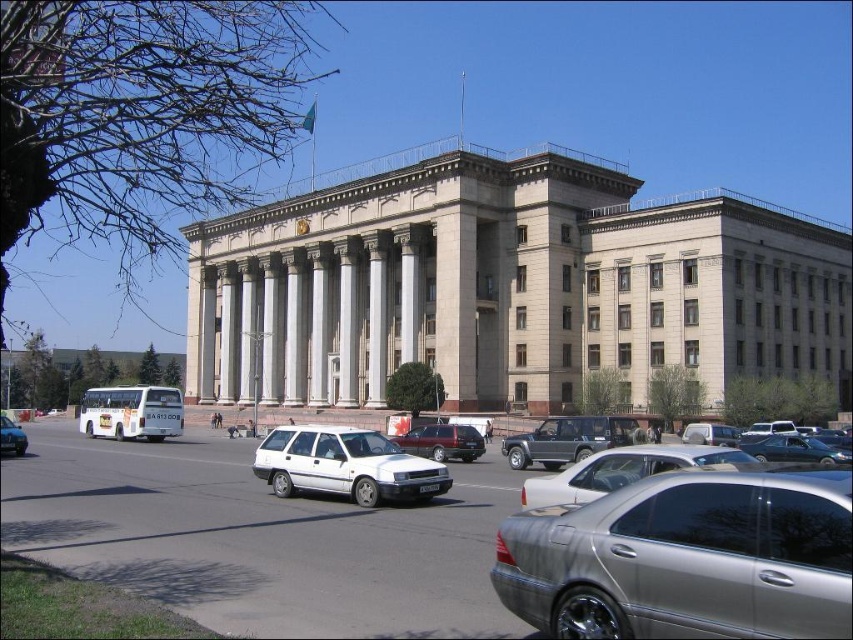
Question: Does metallic gray suv at center appear over white matte sedan at center?

Choices:
 (A) no
 (B) yes

Answer: (A)

Question: Is silver metallic sedan at center further to the viewer compared to white matte sedan at center?

Choices:
 (A) no
 (B) yes

Answer: (A)

Question: Which point appears closest to the camera in this image?

Choices:
 (A) (277, 486)
 (B) (19, 440)
 (C) (550, 428)

Answer: (A)

Question: Can you confirm if silver metallic sedan at center is wider than metallic gray suv at center?

Choices:
 (A) yes
 (B) no

Answer: (A)

Question: Which of the following is the farthest from the observer?

Choices:
 (A) (468, 445)
 (B) (346, 436)

Answer: (A)

Question: Which point is farther from the camera taking this photo?

Choices:
 (A) (4, 449)
 (B) (456, 435)
 (C) (514, 604)

Answer: (B)